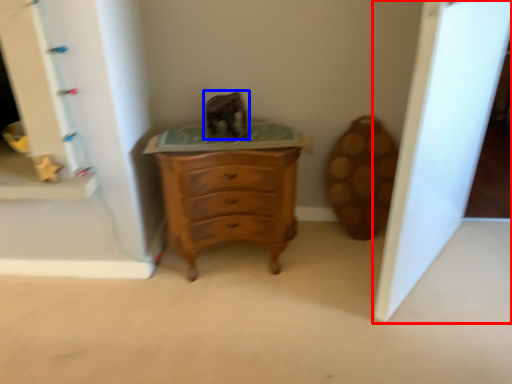
Question: Which of the following is the farthest to the observer, glass door (highlighted by a red box) or animal (highlighted by a blue box)?

Choices:
 (A) glass door
 (B) animal

Answer: (B)